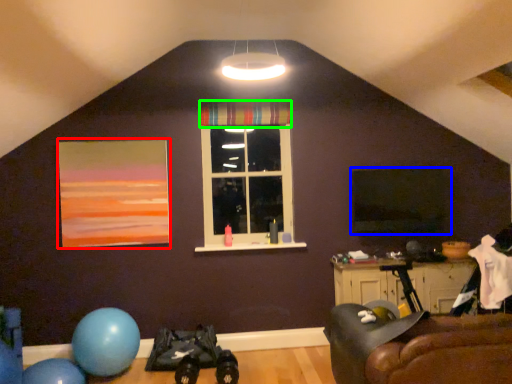
Question: Which object is the farthest from picture frame (highlighted by a red box)? Choose among these: window screen (highlighted by a blue box) or curtain (highlighted by a green box).

Choices:
 (A) window screen
 (B) curtain

Answer: (A)